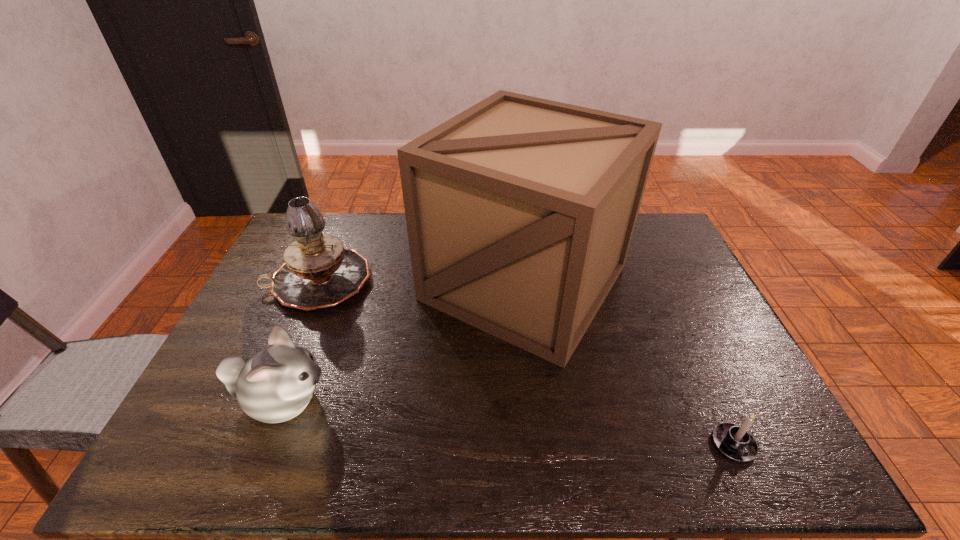
This screenshot has width=960, height=540. Find the location of `vacant area that lies between the hamster and the box`. vacant area that lies between the hamster and the box is located at coordinates (404, 342).

Identify the location of vacant region between the shortest object and the hamster. (508, 423).

Image resolution: width=960 pixels, height=540 pixels. In order to click on free space between the shortest object and the oil lamp in this screenshot , I will do `click(526, 363)`.

Find the location of a particular element. vacant point located between the oil lamp and the shortest object is located at coordinates (526, 363).

What are the coordinates of `vacant point located between the hamster and the second tallest object` in the screenshot? It's located at (300, 342).

Locate an element on the screen. Image resolution: width=960 pixels, height=540 pixels. free spot between the third object from left to right and the candle holder is located at coordinates (629, 363).

Where is `vacant area between the third tallest object and the oil lamp`? vacant area between the third tallest object and the oil lamp is located at coordinates (300, 342).

Find the location of a particular element. This screenshot has height=540, width=960. free space between the second object from right to left and the hamster is located at coordinates point(404,342).

I want to click on object that stands as the closest to the second object from right to left, so click(x=318, y=272).

Where is `the closest object to the rightmost object`? the closest object to the rightmost object is located at coordinates (520, 211).